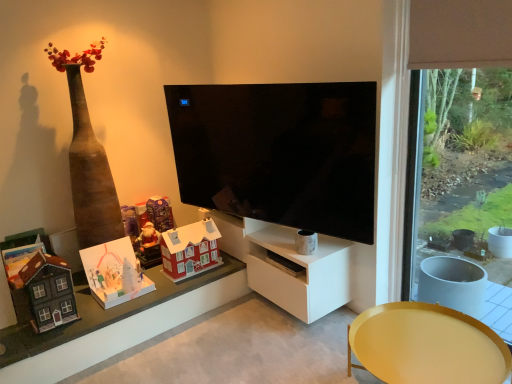
Identify the location of vacant point to the right of white paper pop-up at lower left, which is the 4th toy in back-to-front order. This screenshot has width=512, height=384. (167, 285).